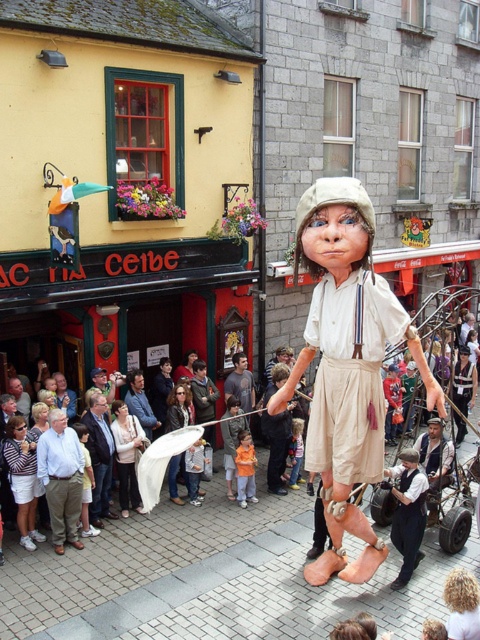
From the picture: Between matte beige fabric doll at center and white cotton shirt at center, which one appears on the right side from the viewer's perspective?

From the viewer's perspective, white cotton shirt at center appears more on the right side.

The width and height of the screenshot is (480, 640). What are the coordinates of `matte beige fabric doll at center` in the screenshot? It's located at (347, 364).

Which is above, khaki pants at lower left or white cotton shirt at center?

khaki pants at lower left is higher up.

Between point (71, 541) and point (412, 458), which one is positioned behind?

The point (71, 541) is more distant.

Locate an element on the screen. This screenshot has width=480, height=640. khaki pants at lower left is located at coordinates (60, 477).

Which is more to the left, matte beige fabric doll at center or dark blue t-shirt at center?

From the viewer's perspective, dark blue t-shirt at center appears more on the left side.

The image size is (480, 640). What do you see at coordinates (347, 364) in the screenshot? I see `matte beige fabric doll at center` at bounding box center [347, 364].

I want to click on matte beige fabric doll at center, so click(x=347, y=364).